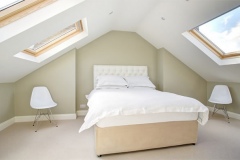
Where is `wall`? wall is located at coordinates (191, 87), (237, 104), (142, 47), (71, 76), (16, 108).